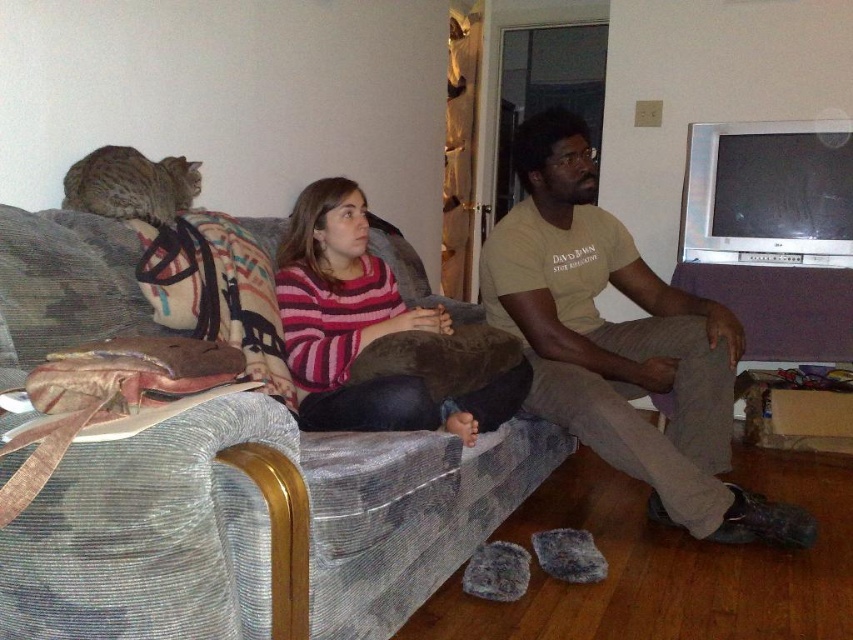
Can you confirm if matte khaki t-shirt at center is smaller than striped knit sweater at center?

Actually, matte khaki t-shirt at center might be larger than striped knit sweater at center.

Locate an element on the screen. The width and height of the screenshot is (853, 640). matte khaki t-shirt at center is located at coordinates (619, 342).

Is point (67, 502) positioned behind point (286, 298)?

No, (67, 502) is in front of (286, 298).

Measure the distance between point (263, 621) and camera.

The distance of point (263, 621) from camera is 3.59 feet.

Identify the location of velvet gray couch at center. The height and width of the screenshot is (640, 853). (257, 529).

Is velvet gray couch at center below matte khaki t-shirt at center?

Yes, velvet gray couch at center is below matte khaki t-shirt at center.

How distant is velvet gray couch at center from matte khaki t-shirt at center?

The distance of velvet gray couch at center from matte khaki t-shirt at center is 22.06 inches.

Who is more distant from viewer, (x=234, y=490) or (x=737, y=342)?

The point (x=737, y=342) is more distant.

At what (x,y) coordinates should I click in order to perform the action: click on velvet gray couch at center. Please return your answer as a coordinate pair (x, y). The height and width of the screenshot is (640, 853). Looking at the image, I should click on (257, 529).